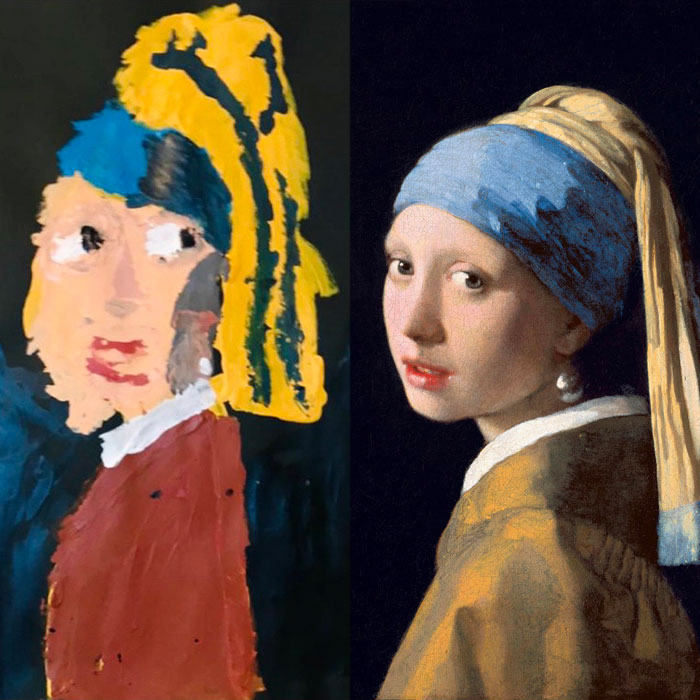
Image resolution: width=700 pixels, height=700 pixels. I want to click on girl with pearl earring painting, so click(524, 481).